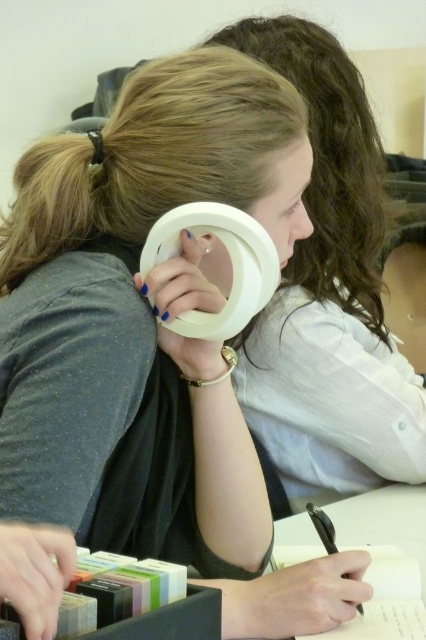
Does white plastic magnifying glass at upper center have a smaller size compared to white paper at center?

Yes.

Is point (213, 328) positioned before point (416, 515)?

Yes, it is.

This screenshot has width=426, height=640. In order to click on white plastic magnifying glass at upper center in this screenshot , I will do `click(227, 264)`.

Between white matte magnifying glass at center and white paper at center, which one is positioned lower?

white paper at center is lower down.

Between point (379, 225) and point (282, 541), which one is positioned behind?

The point (379, 225) is more distant.

Is point (351, 273) positioned after point (406, 509)?

Yes, it is.

You are a GUI agent. You are given a task and a screenshot of the screen. Output one action in this format:
    pyautogui.click(x=<x>, y=<y>)
    Task: Click on the white matte magnifying glass at center
    This screenshot has width=426, height=640.
    Given the screenshot: What is the action you would take?
    pyautogui.click(x=328, y=296)

Does white matte magnifying glass at center have a greater height compared to white plastic magnifying glass at upper center?

Indeed, white matte magnifying glass at center has a greater height compared to white plastic magnifying glass at upper center.

Locate an element on the screen. The image size is (426, 640). white matte magnifying glass at center is located at coordinates (328, 296).

Which is in front, point (330, 140) or point (198, 324)?

Point (198, 324) is more forward.

Locate an element on the screen. white matte magnifying glass at center is located at coordinates (328, 296).